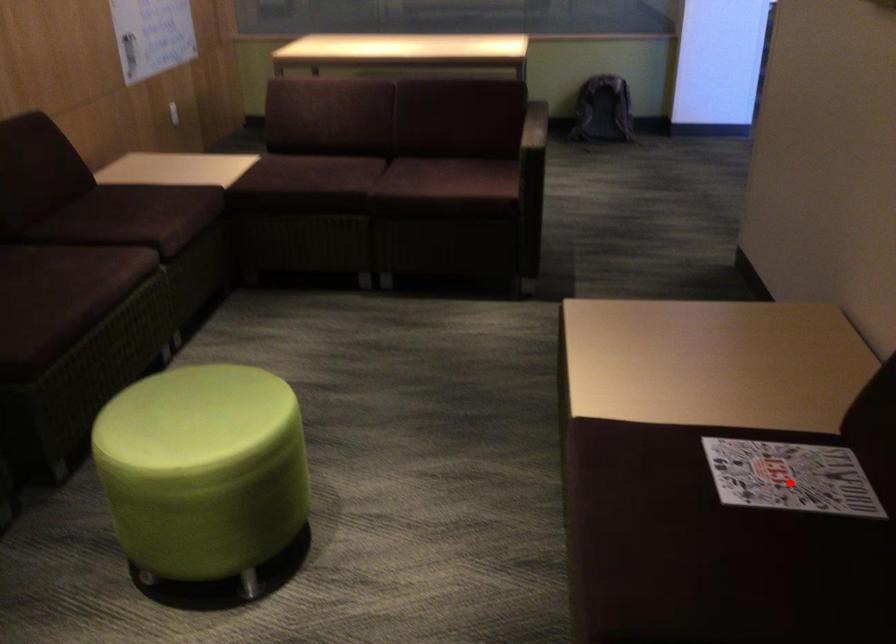
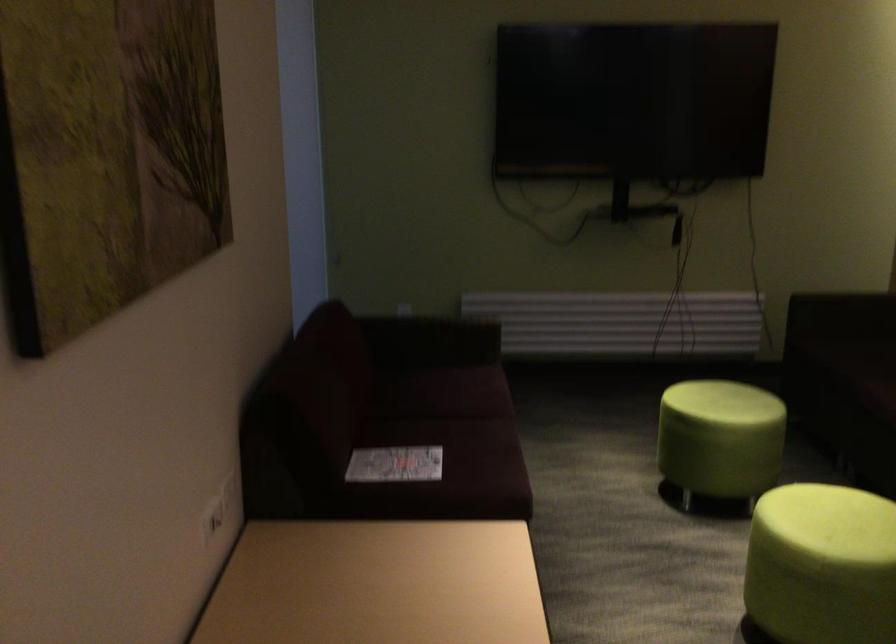
Locate, in the second image, the point that corresponds to the highlighted location in the first image.

(394, 464)